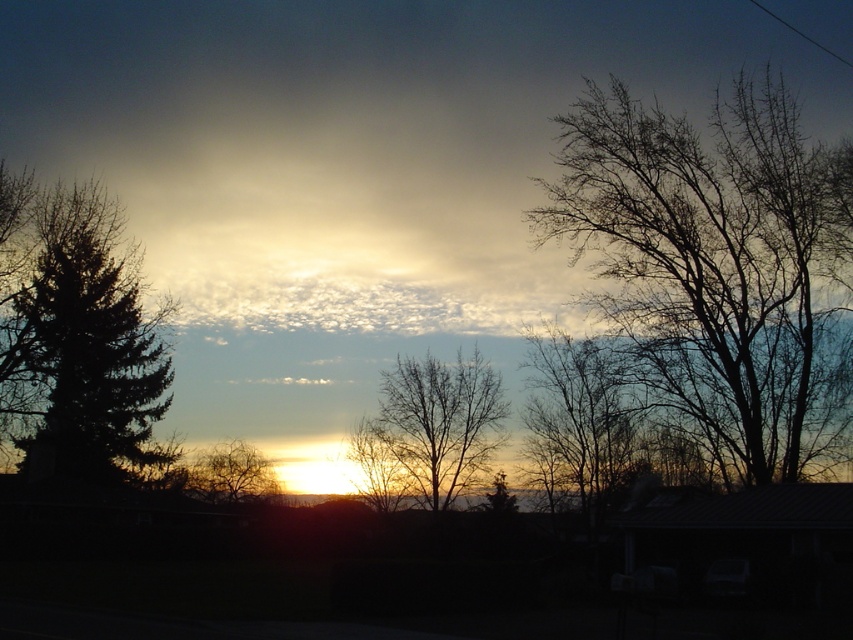
Question: Which of the following is the closest to the observer?

Choices:
 (A) bare branches at center
 (B) bare branches at right

Answer: (B)

Question: Does bare branches at right have a lesser width compared to dark green coniferous tree at left?

Choices:
 (A) yes
 (B) no

Answer: (B)

Question: Is bare branches at right thinner than dark green coniferous tree at left?

Choices:
 (A) no
 (B) yes

Answer: (A)

Question: Is bare branches at center above brown textured tree at center?

Choices:
 (A) yes
 (B) no

Answer: (A)

Question: Estimate the real-world distances between objects in this image. Which object is closer to the bare branches at center?

Choices:
 (A) bare branches at right
 (B) dark green coniferous tree at left

Answer: (B)

Question: Which point is farther to the camera?

Choices:
 (A) bare branches at right
 (B) bare branches at center

Answer: (B)